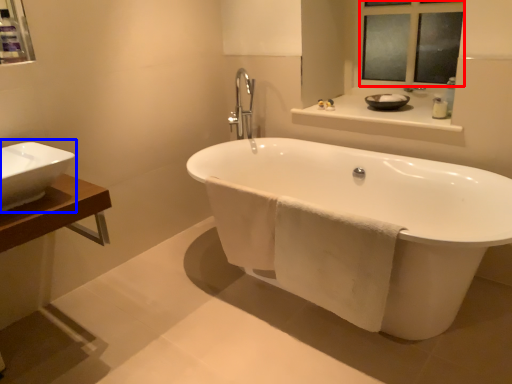
Question: Among these objects, which one is nearest to the camera, mirror (highlighted by a red box) or sink (highlighted by a blue box)?

Choices:
 (A) mirror
 (B) sink

Answer: (B)